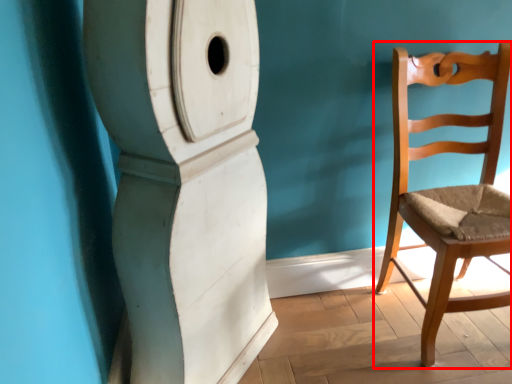
Question: Observing the image, what is the correct spatial positioning of chair (annotated by the red box) in reference to pillar?

Choices:
 (A) left
 (B) right

Answer: (B)